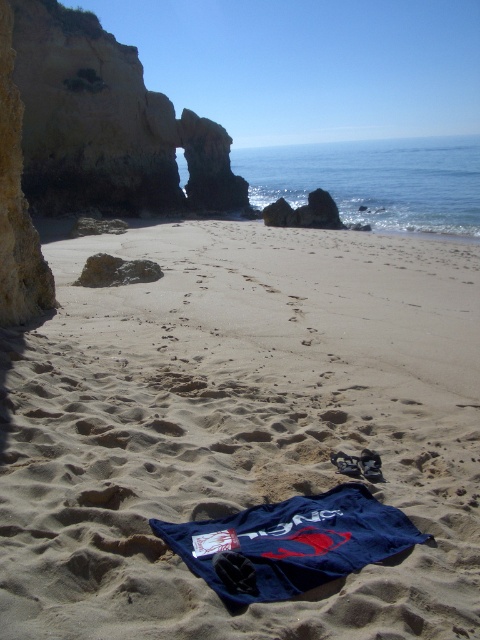
Looking at this image, you are planning to set up a picnic on the beach and have a large blanket that can cover the brown rocky arch at upper left. Will the sandy textured towel at center fit entirely under the blanket if you place it there?

The sandy textured towel at center is smaller than the brown rocky arch at upper left. Since the blanket can cover the brown rocky arch at upper left, which is larger, the sandy textured towel at center will fit entirely under the blanket.

You are standing at the point marked as point 0.609, 0.958. You want to walk to the point marked as point (287,388). How far will you have to walk?

The distance between the two points is 4.90 meters, so you will have to walk 4.90 meters.